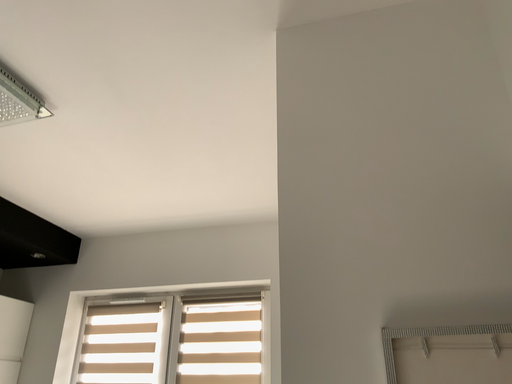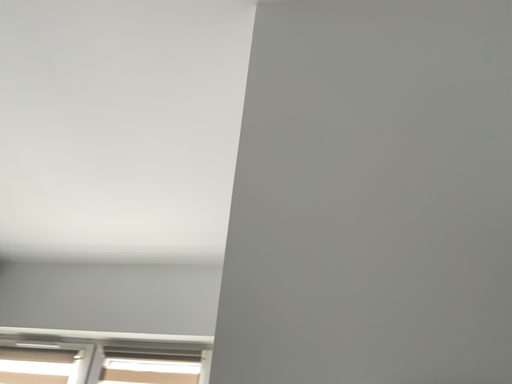
Question: How did the camera likely rotate when shooting the video?

Choices:
 (A) rotated downward
 (B) rotated upward

Answer: (B)